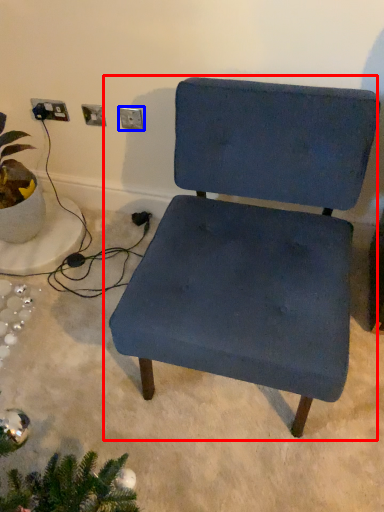
Question: Which of the following is the farthest to the observer, chair (highlighted by a red box) or electric outlet (highlighted by a blue box)?

Choices:
 (A) chair
 (B) electric outlet

Answer: (B)